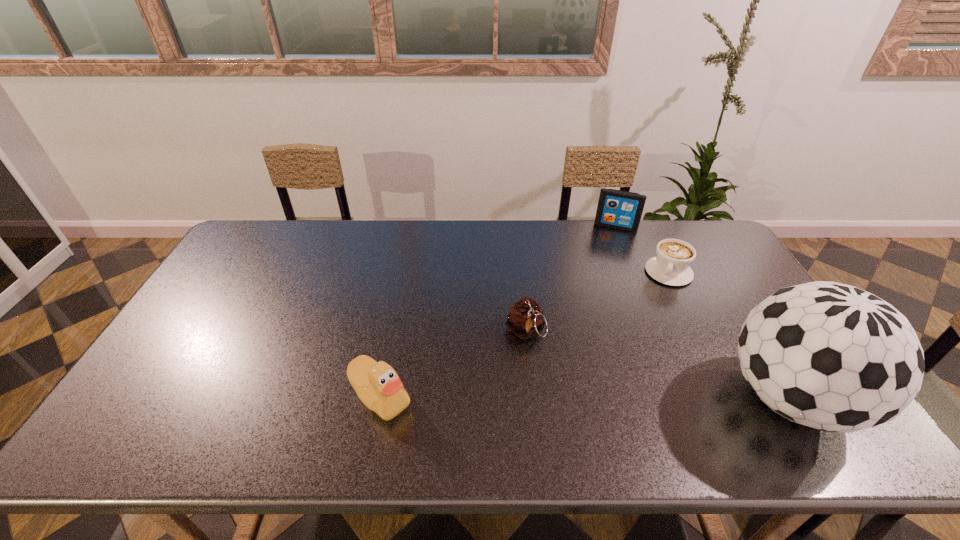
Identify the location of free space between the duck and the soccer ball. (585, 397).

Find the location of `vacant area that lies between the soccer ball and the fourth nearest object`. vacant area that lies between the soccer ball and the fourth nearest object is located at coordinates (729, 335).

Identify the location of empty location between the farthest object and the tallest object. (703, 312).

The width and height of the screenshot is (960, 540). I want to click on free space between the farthest object and the leftmost object, so click(498, 312).

Image resolution: width=960 pixels, height=540 pixels. Find the location of `vacant point located between the cappuccino and the second shortest object`. vacant point located between the cappuccino and the second shortest object is located at coordinates (597, 302).

The width and height of the screenshot is (960, 540). In order to click on object that can be found as the closest to the second object from left to right in this screenshot , I will do click(378, 386).

Find the location of a particular element. This screenshot has height=540, width=960. the third closest object to the second shortest object is located at coordinates (830, 356).

This screenshot has width=960, height=540. Identify the location of blank area in the image that satisfies the following two spatial constraints: 1. on the front side of the shortest object; 2. on the right side of the farthest object. (634, 272).

This screenshot has width=960, height=540. In order to click on vacant space that satisfies the following two spatial constraints: 1. at the beak of the leftmost object; 2. on the right side of the soccer ball in this screenshot , I will do `click(380, 398)`.

The image size is (960, 540). I want to click on vacant area that satisfies the following two spatial constraints: 1. on the front side of the tallest object; 2. on the left side of the iPod, so click(684, 398).